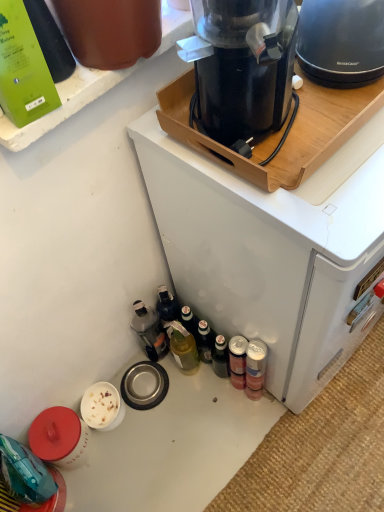
The width and height of the screenshot is (384, 512). I want to click on free location in front of black plastic coffee maker at upper center, so click(292, 441).